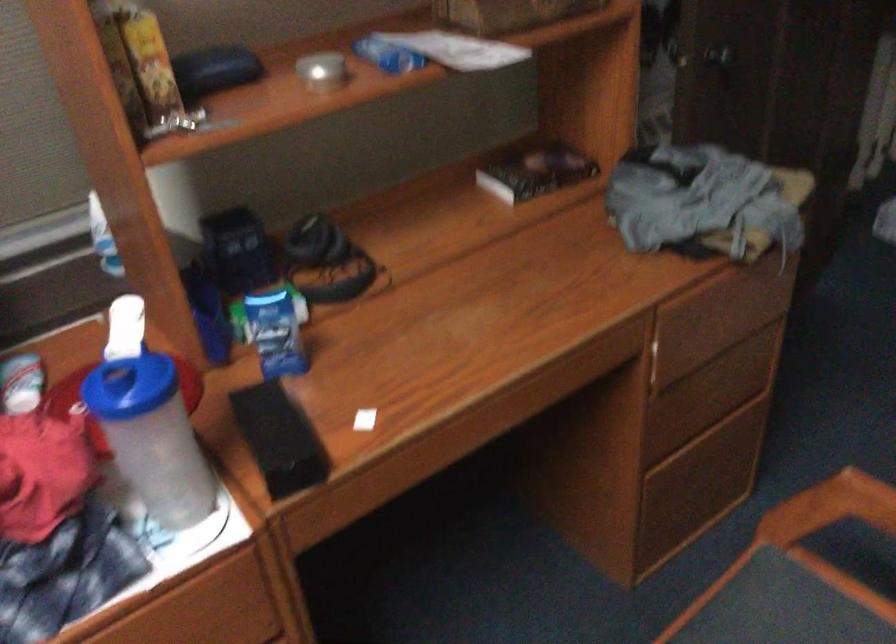
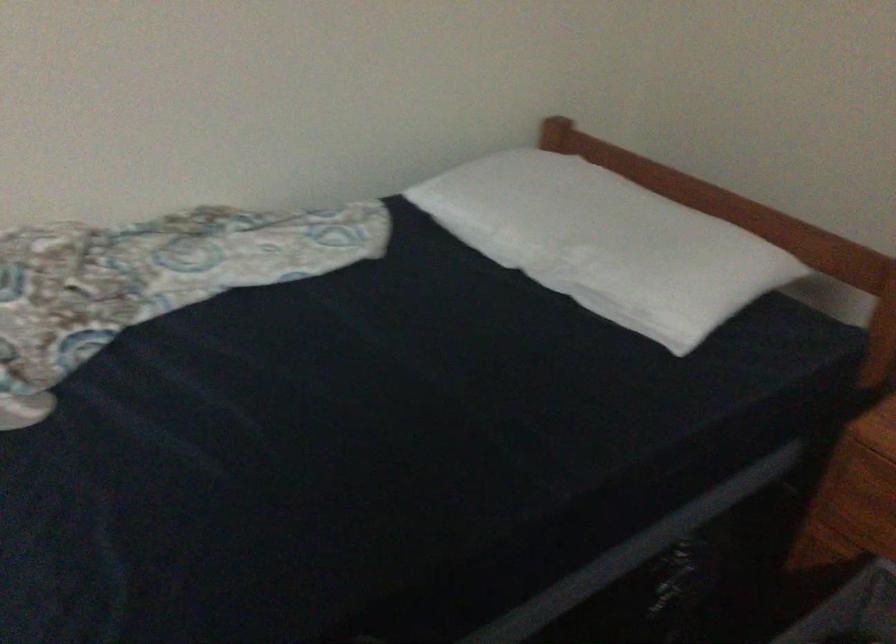
First-person continuous shooting, in which direction is the camera rotating?

The camera's rotation is toward right-down.